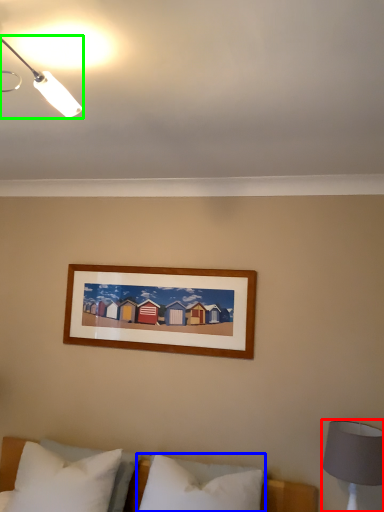
Question: Which object is the farthest from bedside lamp (highlighted by a red box)? Choose among these: pillow (highlighted by a blue box) or lamp (highlighted by a green box).

Choices:
 (A) pillow
 (B) lamp

Answer: (B)